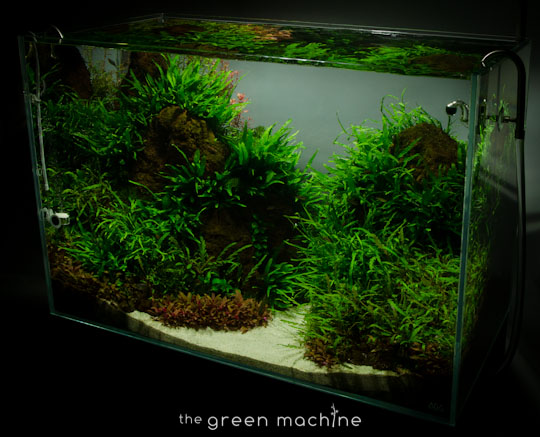
The height and width of the screenshot is (437, 540). I want to click on fish tank, so click(x=270, y=172).